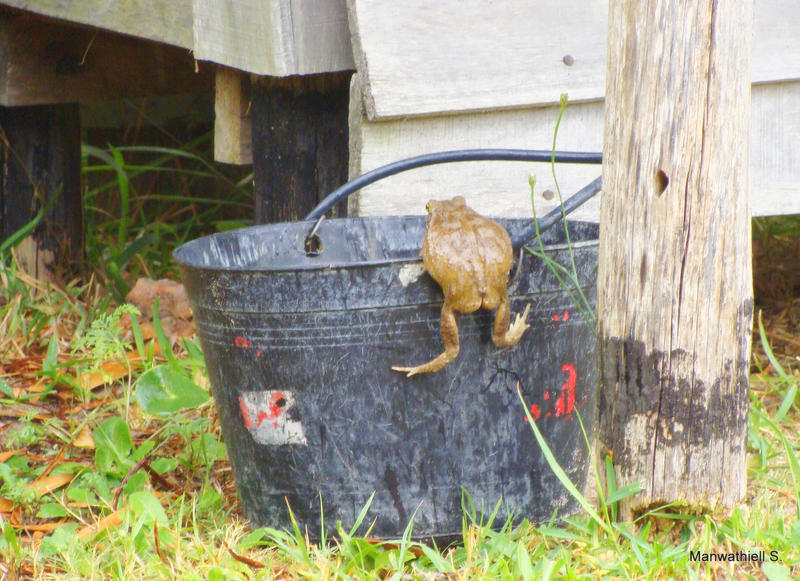
Identify the location of bucket. (370, 390).